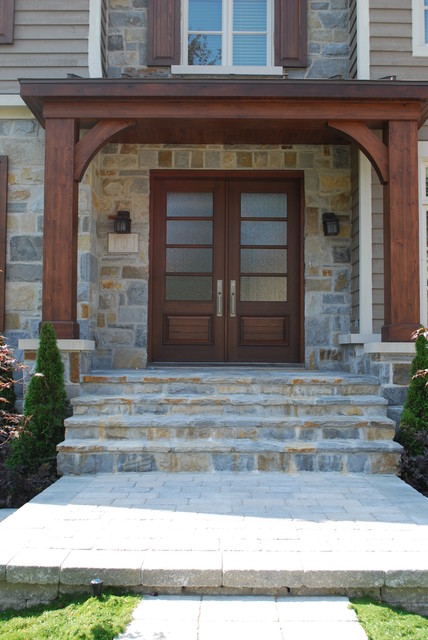
The image size is (428, 640). I want to click on window shudders, so click(x=161, y=29), click(x=290, y=34).